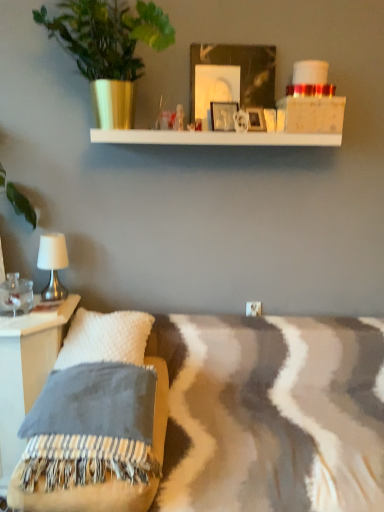
Where is `metallic silver picture frame at upper center, which appears as the 2th picture frame when viewed from the left`? The height and width of the screenshot is (512, 384). metallic silver picture frame at upper center, which appears as the 2th picture frame when viewed from the left is located at coordinates (256, 119).

The height and width of the screenshot is (512, 384). In order to click on metallic silver picture frame at upper center, the first picture frame from the left in this screenshot , I will do `click(223, 115)`.

At what (x,y) coordinates should I click in order to perform the action: click on white fuzzy pillow at lower left. Please return your answer as a coordinate pair (x, y). This screenshot has height=512, width=384. Looking at the image, I should click on (105, 338).

The height and width of the screenshot is (512, 384). I want to click on green leafy plant in gold pot at upper left, so click(108, 49).

The width and height of the screenshot is (384, 512). What are the coordinates of `metallic silver picture frame at upper center, the first picture frame viewed from the right` in the screenshot? It's located at (256, 119).

How distant is metallic silver picture frame at upper center, the first picture frame viewed from the right, from silver metallic table lamp at left?

1.11 meters.

Is metallic silver picture frame at upper center, the first picture frame viewed from the right, touching silver metallic table lamp at left?

No, metallic silver picture frame at upper center, the first picture frame viewed from the right, is not with silver metallic table lamp at left.

Is metallic silver picture frame at upper center, the first picture frame viewed from the right, bigger or smaller than silver metallic table lamp at left?

Considering their sizes, metallic silver picture frame at upper center, the first picture frame viewed from the right, takes up less space than silver metallic table lamp at left.

From a real-world perspective, which object rests below the other?

silver metallic table lamp at left is physically lower.

From the picture: Is silver metallic table lamp at left further to the viewer compared to metallic silver picture frame at upper center, which appears as the 2th picture frame when viewed from the left?

Yes, silver metallic table lamp at left is further from the viewer.

Is silver metallic table lamp at left to the left of metallic silver picture frame at upper center, the first picture frame viewed from the right, from the viewer's perspective?

Yes, silver metallic table lamp at left is to the left of metallic silver picture frame at upper center, the first picture frame viewed from the right.

Is silver metallic table lamp at left positioned with its back to metallic silver picture frame at upper center, which appears as the 2th picture frame when viewed from the left?

That's not correct — silver metallic table lamp at left is not looking away from metallic silver picture frame at upper center, which appears as the 2th picture frame when viewed from the left.

Are silver metallic table lamp at left and metallic silver picture frame at upper center, the first picture frame viewed from the right, far apart?

Yes.

Looking at this image, is white fuzzy pillow at lower left facing away from green leafy plant in gold pot at upper left?

No, white fuzzy pillow at lower left is not facing away from green leafy plant in gold pot at upper left.

From a real-world perspective, is white fuzzy pillow at lower left physically located above or below green leafy plant in gold pot at upper left?

white fuzzy pillow at lower left is situated lower than green leafy plant in gold pot at upper left in the real world.

What's the angular difference between white fuzzy pillow at lower left and green leafy plant in gold pot at upper left's facing directions?

1.06 degrees.

Is white fuzzy pillow at lower left smaller than green leafy plant in gold pot at upper left?

Correct, white fuzzy pillow at lower left occupies less space than green leafy plant in gold pot at upper left.

Does point (216, 121) lie behind point (58, 247)?

No, (216, 121) is closer to viewer.

From the image's perspective, is metallic silver picture frame at upper center, marked as the second picture frame in a right-to-left arrangement, below silver metallic table lamp at left?

Actually, metallic silver picture frame at upper center, marked as the second picture frame in a right-to-left arrangement, appears above silver metallic table lamp at left in the image.

From a real-world perspective, does metallic silver picture frame at upper center, marked as the second picture frame in a right-to-left arrangement, sit lower than silver metallic table lamp at left?

Incorrect, from a real-world perspective, metallic silver picture frame at upper center, marked as the second picture frame in a right-to-left arrangement, is higher than silver metallic table lamp at left.

Which is more to the right, metallic silver picture frame at upper center, the first picture frame from the left, or silver metallic table lamp at left?

metallic silver picture frame at upper center, the first picture frame from the left.

Is silver metallic table lamp at left to the left of white fuzzy pillow at lower left from the viewer's perspective?

Indeed, silver metallic table lamp at left is positioned on the left side of white fuzzy pillow at lower left.

In terms of size, does silver metallic table lamp at left appear bigger or smaller than white fuzzy pillow at lower left?

Considering their sizes, silver metallic table lamp at left takes up less space than white fuzzy pillow at lower left.

Considering the sizes of objects silver metallic table lamp at left and white fuzzy pillow at lower left in the image provided, who is thinner, silver metallic table lamp at left or white fuzzy pillow at lower left?

silver metallic table lamp at left.

From a real-world perspective, is silver metallic table lamp at left positioned under white fuzzy pillow at lower left based on gravity?

No, from a real-world perspective, silver metallic table lamp at left is not beneath white fuzzy pillow at lower left.

Looking at their sizes, would you say metallic silver picture frame at upper center, marked as the second picture frame in a right-to-left arrangement, is wider or thinner than metallic silver picture frame at upper center, which appears as the 2th picture frame when viewed from the left?

Considering their sizes, metallic silver picture frame at upper center, marked as the second picture frame in a right-to-left arrangement, looks slimmer than metallic silver picture frame at upper center, which appears as the 2th picture frame when viewed from the left.

Which of these two, metallic silver picture frame at upper center, the first picture frame from the left, or metallic silver picture frame at upper center, which appears as the 2th picture frame when viewed from the left, is smaller?

metallic silver picture frame at upper center, which appears as the 2th picture frame when viewed from the left.

Looking at this image, between metallic silver picture frame at upper center, marked as the second picture frame in a right-to-left arrangement, and metallic silver picture frame at upper center, the first picture frame viewed from the right, which one appears on the right side from the viewer's perspective?

Positioned to the right is metallic silver picture frame at upper center, the first picture frame viewed from the right.

Looking at this image, is metallic silver picture frame at upper center, the first picture frame from the left, not inside metallic silver picture frame at upper center, the first picture frame viewed from the right?

Yes, metallic silver picture frame at upper center, the first picture frame from the left, is located beyond the bounds of metallic silver picture frame at upper center, the first picture frame viewed from the right.

Is metallic silver picture frame at upper center, the first picture frame viewed from the right, taller than green leafy plant in gold pot at upper left?

No.

Is metallic silver picture frame at upper center, which appears as the 2th picture frame when viewed from the left, positioned with its back to green leafy plant in gold pot at upper left?

No, metallic silver picture frame at upper center, which appears as the 2th picture frame when viewed from the left,'s orientation is not away from green leafy plant in gold pot at upper left.

Consider the image. How many degrees apart are the facing directions of metallic silver picture frame at upper center, which appears as the 2th picture frame when viewed from the left, and green leafy plant in gold pot at upper left?

The facing directions of metallic silver picture frame at upper center, which appears as the 2th picture frame when viewed from the left, and green leafy plant in gold pot at upper left are 23.4 degrees apart.

From a real-world perspective, who is located higher, metallic silver picture frame at upper center, which appears as the 2th picture frame when viewed from the left, or green leafy plant in gold pot at upper left?

In real-world perspective, green leafy plant in gold pot at upper left is above.

This screenshot has width=384, height=512. There is a silver metallic table lamp at left. Find the location of `the 1st picture frame above it (from the image's perspective)`. the 1st picture frame above it (from the image's perspective) is located at coordinates (256, 119).

Identify the location of the 1st picture frame in front of the silver metallic table lamp at left, counting from the anchor's position. The height and width of the screenshot is (512, 384). (256, 119).

When comparing their distances from metallic silver picture frame at upper center, marked as the second picture frame in a right-to-left arrangement, does green leafy plant in gold pot at upper left or silver metallic table lamp at left seem further?

silver metallic table lamp at left is positioned further to the anchor metallic silver picture frame at upper center, marked as the second picture frame in a right-to-left arrangement.

When comparing their distances from silver metallic table lamp at left, does metallic silver picture frame at upper center, which appears as the 2th picture frame when viewed from the left, or green leafy plant in gold pot at upper left seem closer?

green leafy plant in gold pot at upper left.

Which object lies further to the anchor point white fuzzy pillow at lower left, metallic silver picture frame at upper center, which appears as the 2th picture frame when viewed from the left, or metallic silver picture frame at upper center, marked as the second picture frame in a right-to-left arrangement?

metallic silver picture frame at upper center, which appears as the 2th picture frame when viewed from the left, lies further to white fuzzy pillow at lower left than the other object.

When comparing their distances from metallic silver picture frame at upper center, marked as the second picture frame in a right-to-left arrangement, does silver metallic table lamp at left or metallic silver picture frame at upper center, which appears as the 2th picture frame when viewed from the left, seem closer?

metallic silver picture frame at upper center, which appears as the 2th picture frame when viewed from the left, is positioned closer to the anchor metallic silver picture frame at upper center, marked as the second picture frame in a right-to-left arrangement.

Considering their positions, is metallic silver picture frame at upper center, the first picture frame from the left, positioned further to metallic silver picture frame at upper center, which appears as the 2th picture frame when viewed from the left, than green leafy plant in gold pot at upper left?

green leafy plant in gold pot at upper left.

From the image, which object appears to be nearer to white fuzzy pillow at lower left, metallic silver picture frame at upper center, the first picture frame from the left, or silver metallic table lamp at left?

silver metallic table lamp at left.

Estimate the real-world distances between objects in this image. Which object is closer to silver metallic table lamp at left, metallic silver picture frame at upper center, which appears as the 2th picture frame when viewed from the left, or metallic silver picture frame at upper center, marked as the second picture frame in a right-to-left arrangement?

metallic silver picture frame at upper center, marked as the second picture frame in a right-to-left arrangement, is positioned closer to the anchor silver metallic table lamp at left.

Which object lies further to the anchor point white fuzzy pillow at lower left, silver metallic table lamp at left or metallic silver picture frame at upper center, which appears as the 2th picture frame when viewed from the left?

metallic silver picture frame at upper center, which appears as the 2th picture frame when viewed from the left.

Find the location of a particular element. The height and width of the screenshot is (512, 384). table lamp between green leafy plant in gold pot at upper left and white fuzzy pillow at lower left in the vertical direction is located at coordinates (53, 264).

You are a GUI agent. You are given a task and a screenshot of the screen. Output one action in this format:
    pyautogui.click(x=<x>, y=<y>)
    Task: Click on the picture frame between metallic silver picture frame at upper center, marked as the second picture frame in a right-to-left arrangement, and white fuzzy pillow at lower left vertically
    The width and height of the screenshot is (384, 512).
    Given the screenshot: What is the action you would take?
    pyautogui.click(x=256, y=119)

Where is `picture frame located between green leafy plant in gold pot at upper left and metallic silver picture frame at upper center, which appears as the 2th picture frame when viewed from the left, in the left-right direction`? This screenshot has width=384, height=512. picture frame located between green leafy plant in gold pot at upper left and metallic silver picture frame at upper center, which appears as the 2th picture frame when viewed from the left, in the left-right direction is located at coordinates (223, 115).

Locate an element on the screen. The height and width of the screenshot is (512, 384). houseplant between silver metallic table lamp at left and metallic silver picture frame at upper center, which appears as the 2th picture frame when viewed from the left, from left to right is located at coordinates (108, 49).